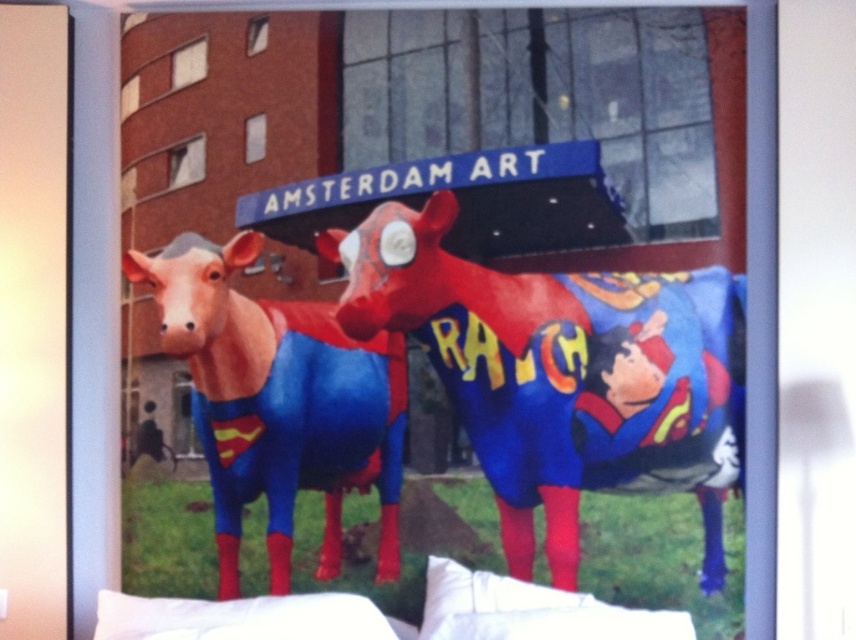
You are an interior designer arranging a living room with two pillows. You have the white fabric pillow at lower center and the white soft pillow at lower center. Which pillow should you place closer to the sofa edge to ensure the design looks balanced?

The white fabric pillow at lower center should be placed closer to the sofa edge because it is in front of the white soft pillow at lower center, creating a balanced and layered look.